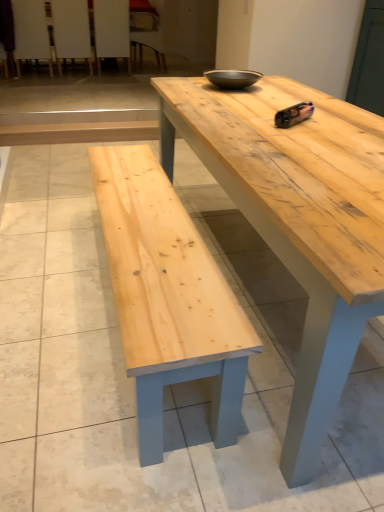
Where is `natural wood table at center`? The width and height of the screenshot is (384, 512). natural wood table at center is located at coordinates (298, 220).

Image resolution: width=384 pixels, height=512 pixels. Describe the element at coordinates (232, 78) in the screenshot. I see `matte black bowl at center` at that location.

Identify the location of matte black bowl at center. (232, 78).

Measure the distance between wooden chair at upper left, the 4th chair from the left, and camera.

The depth of wooden chair at upper left, the 4th chair from the left, is 5.50 meters.

What do you see at coordinates (148, 31) in the screenshot?
I see `wooden chair at upper left, which is the 1th chair from right to left` at bounding box center [148, 31].

Find the location of a particular element. natural wood table at center is located at coordinates (298, 220).

In the scene shown: Is wooden chair at upper left, which is the 1th chair from right to left, not within white wood chair at upper left, which is the 3th chair in left-to-right order?

Absolutely, wooden chair at upper left, which is the 1th chair from right to left, is external to white wood chair at upper left, which is the 3th chair in left-to-right order.

Can you tell me how much wooden chair at upper left, the 4th chair from the left, and white wood chair at upper left, the second chair in the right-to-left sequence, differ in facing direction?

They differ by 90 degrees in their facing directions.

Which object is positioned more to the left, wooden chair at upper left, which is the 1th chair from right to left, or white wood chair at upper left, the second chair in the right-to-left sequence?

Positioned to the left is white wood chair at upper left, the second chair in the right-to-left sequence.

Is wooden chair at upper left, which is the 1th chair from right to left, bigger or smaller than white wood chair at upper left, the second chair in the right-to-left sequence?

Clearly, wooden chair at upper left, which is the 1th chair from right to left, is larger in size than white wood chair at upper left, the second chair in the right-to-left sequence.

Which is behind, wooden chair at upper left, the 4th chair from the left, or wooden chair at upper left, placed as the second chair when sorted from left to right?

wooden chair at upper left, the 4th chair from the left, is more distant.

What's the angular difference between wooden chair at upper left, the 4th chair from the left, and wooden chair at upper left, placed as the 3th chair when sorted from right to left,'s facing directions?

The angular difference between wooden chair at upper left, the 4th chair from the left, and wooden chair at upper left, placed as the 3th chair when sorted from right to left, is 87.5 degrees.

In terms of width, does wooden chair at upper left, which is the 1th chair from right to left, look wider or thinner when compared to wooden chair at upper left, placed as the second chair when sorted from left to right?

Considering their sizes, wooden chair at upper left, which is the 1th chair from right to left, looks broader than wooden chair at upper left, placed as the second chair when sorted from left to right.

From a real-world perspective, is wooden chair at upper left, the 4th chair from the left, physically located above or below wooden chair at upper left, placed as the 3th chair when sorted from right to left?

From a real-world perspective, wooden chair at upper left, the 4th chair from the left, is physically below wooden chair at upper left, placed as the 3th chair when sorted from right to left.

Can you tell me how much white wood chair at upper left, which is the 3th chair in left-to-right order, and matte black bowl at center differ in facing direction?

There is a 176-degree angle between the facing directions of white wood chair at upper left, which is the 3th chair in left-to-right order, and matte black bowl at center.

From a real-world perspective, does white wood chair at upper left, the second chair in the right-to-left sequence, stand above matte black bowl at center?

No, from a real-world perspective, white wood chair at upper left, the second chair in the right-to-left sequence, is not over matte black bowl at center

Does white wood chair at upper left, which is the 3th chair in left-to-right order, come behind matte black bowl at center?

Yes, white wood chair at upper left, which is the 3th chair in left-to-right order, is further from the viewer.

Consider the image. Which is closer, (122, 42) or (250, 74)?

The point (250, 74) is in front.

Which object is more forward, wooden chair at upper left, placed as the 3th chair when sorted from right to left, or wooden chair at upper left, which is the 1th chair from right to left?

wooden chair at upper left, placed as the 3th chair when sorted from right to left.

Is wooden chair at upper left, placed as the second chair when sorted from left to right, positioned with its back to wooden chair at upper left, the 4th chair from the left?

No.

Which is in front, point (75, 35) or point (157, 49)?

The point (157, 49) is closer.

Choose the correct answer: Is wooden chair at upper left, placed as the second chair when sorted from left to right, inside wooden chair at upper left, the 4th chair from the left, or outside it?

wooden chair at upper left, placed as the second chair when sorted from left to right, cannot be found inside wooden chair at upper left, the 4th chair from the left.

Does matte black bowl at center have a smaller size compared to wooden chair at upper left, placed as the 3th chair when sorted from right to left?

Correct, matte black bowl at center occupies less space than wooden chair at upper left, placed as the 3th chair when sorted from right to left.

The height and width of the screenshot is (512, 384). I want to click on bowl below the wooden chair at upper left, placed as the 3th chair when sorted from right to left (from the image's perspective), so click(x=232, y=78).

Which is closer, (x=213, y=70) or (x=63, y=26)?

Point (x=213, y=70) appears to be closer to the viewer than point (x=63, y=26).

Considering their positions, is matte black bowl at center located in front of or behind wooden chair at upper left, placed as the second chair when sorted from left to right?

matte black bowl at center is in front of wooden chair at upper left, placed as the second chair when sorted from left to right.

Is there a large distance between wooden chair at upper left, positioned as the 4th chair in right-to-left order, and wooden chair at upper left, which is the 1th chair from right to left?

Yes.

Which is in front, wooden chair at upper left, positioned as the 4th chair in right-to-left order, or wooden chair at upper left, which is the 1th chair from right to left?

wooden chair at upper left, positioned as the 4th chair in right-to-left order, is more forward.

From a real-world perspective, who is located higher, wooden chair at upper left, positioned as the 1th chair in left-to-right order, or wooden chair at upper left, the 4th chair from the left?

In real-world perspective, wooden chair at upper left, positioned as the 1th chair in left-to-right order, is above.

Is wooden chair at upper left, placed as the 3th chair when sorted from right to left, facing away from matte black bowl at center?

Yes, wooden chair at upper left, placed as the 3th chair when sorted from right to left,'s orientation is away from matte black bowl at center.

Looking at the image, does wooden chair at upper left, placed as the 3th chair when sorted from right to left, seem bigger or smaller compared to matte black bowl at center?

In the image, wooden chair at upper left, placed as the 3th chair when sorted from right to left, appears to be larger than matte black bowl at center.

Which point is more distant from viewer, (86, 39) or (247, 70)?

The point (86, 39) is more distant.

Which is more to the right, wooden chair at upper left, placed as the 3th chair when sorted from right to left, or matte black bowl at center?

From the viewer's perspective, matte black bowl at center appears more on the right side.

The width and height of the screenshot is (384, 512). I want to click on chair on the right of white wood chair at upper left, the second chair in the right-to-left sequence, so click(148, 31).

Locate an element on the screen. This screenshot has width=384, height=512. the 2nd chair in front when counting from the wooden chair at upper left, the 4th chair from the left is located at coordinates (71, 31).

Considering their positions, is wooden chair at upper left, placed as the second chair when sorted from left to right, positioned closer to matte black bowl at center than wooden chair at upper left, positioned as the 4th chair in right-to-left order?

wooden chair at upper left, placed as the second chair when sorted from left to right, is positioned closer to the anchor matte black bowl at center.

Which object lies further to the anchor point wooden chair at upper left, placed as the second chair when sorted from left to right, wooden chair at upper left, the 4th chair from the left, or white wood chair at upper left, the second chair in the right-to-left sequence?

The object further to wooden chair at upper left, placed as the second chair when sorted from left to right, is wooden chair at upper left, the 4th chair from the left.

From the image, which object appears to be farther from wooden chair at upper left, which is the 1th chair from right to left, white wood chair at upper left, which is the 3th chair in left-to-right order, or matte black bowl at center?

Among the two, matte black bowl at center is located further to wooden chair at upper left, which is the 1th chair from right to left.

Estimate the real-world distances between objects in this image. Which object is further from natural wood table at center, wooden chair at upper left, the 4th chair from the left, or white wood chair at upper left, which is the 3th chair in left-to-right order?

white wood chair at upper left, which is the 3th chair in left-to-right order, is further to natural wood table at center.

Which object lies nearer to the anchor point natural wood table at center, wooden chair at upper left, placed as the second chair when sorted from left to right, or matte black bowl at center?

Among the two, matte black bowl at center is located nearer to natural wood table at center.

Looking at the image, which one is located further to wooden chair at upper left, the 4th chair from the left, wooden chair at upper left, positioned as the 4th chair in right-to-left order, or matte black bowl at center?

The object further to wooden chair at upper left, the 4th chair from the left, is matte black bowl at center.

When comparing their distances from wooden chair at upper left, placed as the second chair when sorted from left to right, does white wood chair at upper left, which is the 3th chair in left-to-right order, or natural wood table at center seem closer?

Among the two, white wood chair at upper left, which is the 3th chair in left-to-right order, is located nearer to wooden chair at upper left, placed as the second chair when sorted from left to right.

Based on their spatial positions, is wooden chair at upper left, the 4th chair from the left, or wooden chair at upper left, placed as the 3th chair when sorted from right to left, closer to wooden chair at upper left, positioned as the 4th chair in right-to-left order?

wooden chair at upper left, placed as the 3th chair when sorted from right to left, is positioned closer to the anchor wooden chair at upper left, positioned as the 4th chair in right-to-left order.

Where is `chair located between matte black bowl at center and wooden chair at upper left, placed as the second chair when sorted from left to right, in the depth direction`? This screenshot has width=384, height=512. chair located between matte black bowl at center and wooden chair at upper left, placed as the second chair when sorted from left to right, in the depth direction is located at coordinates [31, 32].

Where is `bowl positioned between natural wood table at center and wooden chair at upper left, which is the 1th chair from right to left, from near to far`? The width and height of the screenshot is (384, 512). bowl positioned between natural wood table at center and wooden chair at upper left, which is the 1th chair from right to left, from near to far is located at coordinates (232, 78).

At what (x,y) coordinates should I click in order to perform the action: click on bowl located between natural wood table at center and white wood chair at upper left, the second chair in the right-to-left sequence, in the depth direction. Please return your answer as a coordinate pair (x, y). Image resolution: width=384 pixels, height=512 pixels. Looking at the image, I should click on (232, 78).

Where is `chair located between natural wood table at center and wooden chair at upper left, placed as the 3th chair when sorted from right to left, in the depth direction`? The height and width of the screenshot is (512, 384). chair located between natural wood table at center and wooden chair at upper left, placed as the 3th chair when sorted from right to left, in the depth direction is located at coordinates (31, 32).